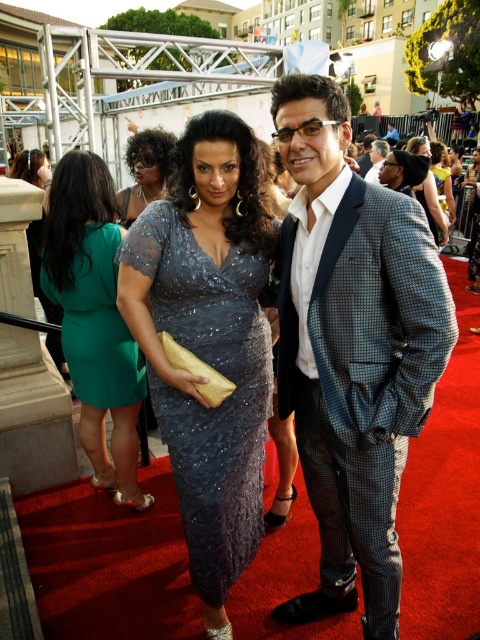
Question: Among these points, which one is nearest to the camera?

Choices:
 (A) (144, 269)
 (B) (421, 147)

Answer: (A)

Question: Is satin shimmer dress at center below shiny silver dress at center?

Choices:
 (A) yes
 (B) no

Answer: (B)

Question: Among these points, which one is nearest to the camera?

Choices:
 (A) (107, 371)
 (B) (432, 212)

Answer: (A)

Question: Among these objects, which one is farthest from the camera?

Choices:
 (A) green satin dress at left
 (B) green lace dress at upper left

Answer: (B)

Question: Does satin sequined dress at center have a larger size compared to teal lace dress at center?

Choices:
 (A) yes
 (B) no

Answer: (A)

Question: Where is green satin dress at left located in relation to shiny silver dress at center in the image?

Choices:
 (A) right
 (B) left

Answer: (B)